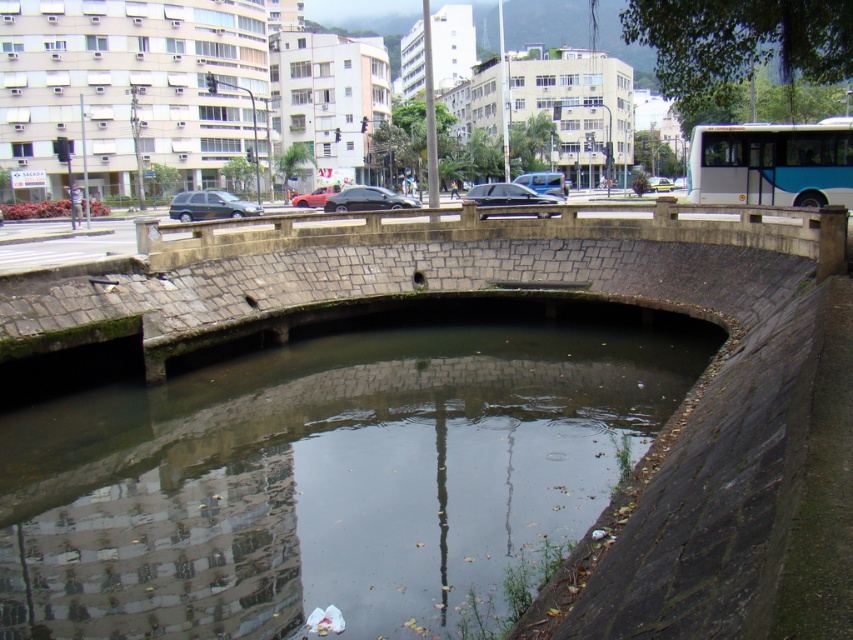
You are standing at the center of the curved stone bridge and want to locate the shiny black sedan at center. In which direction should you look relative to the bridge?

The shiny black sedan at center is located at the point with coordinates 0.312 on the x axis and 0.431 on the y axis, so you should look towards the coordinates (367,198) relative to the bridge.